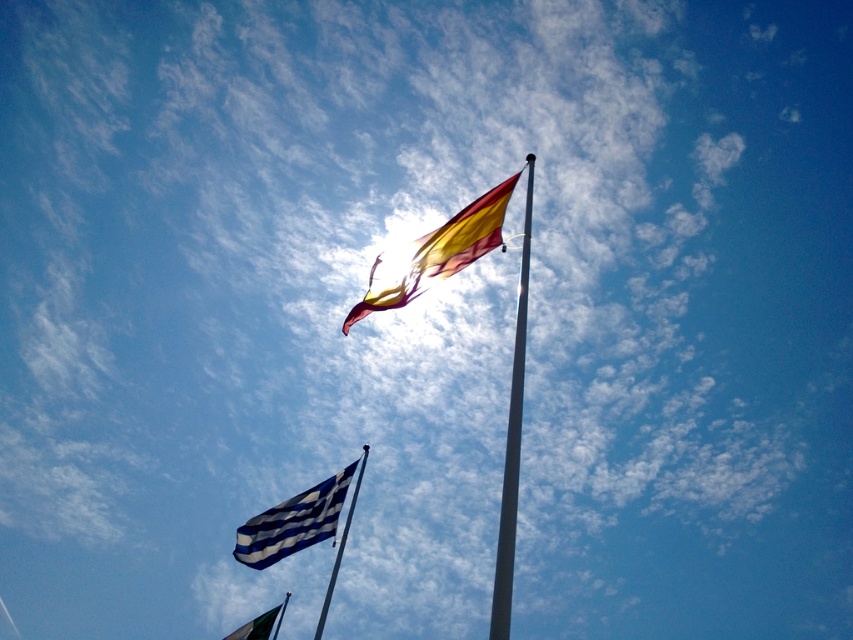
Which of these two, blue/white striped flag at lower left or green fabric flag at lower left, stands taller?

With more height is green fabric flag at lower left.

Does blue/white striped flag at lower left lie in front of green fabric flag at lower left?

Yes, it is in front of green fabric flag at lower left.

Is point (339, 481) positioned after point (252, 627)?

No, it is in front of (252, 627).

Image resolution: width=853 pixels, height=640 pixels. I want to click on blue/white striped flag at lower left, so click(x=293, y=522).

Is smooth metal pole at center in front of silver metallic flag pole at lower center?

Yes, smooth metal pole at center is in front of silver metallic flag pole at lower center.

Can you confirm if smooth metal pole at center is thinner than silver metallic flag pole at lower center?

No.

Between point (503, 620) and point (367, 445), which one is positioned in front?

Point (503, 620) is in front.

Locate an element on the screen. smooth metal pole at center is located at coordinates (512, 444).

Who is shorter, yellow-red fabric flag at center or blue/white striped flag at lower left?

blue/white striped flag at lower left

Between yellow-red fabric flag at center and blue/white striped flag at lower left, which one is positioned higher?

yellow-red fabric flag at center is above.

Measure the distance between yellow-red fabric flag at center and camera.

12.80 meters

Locate an element on the screen. The width and height of the screenshot is (853, 640). yellow-red fabric flag at center is located at coordinates (434, 253).